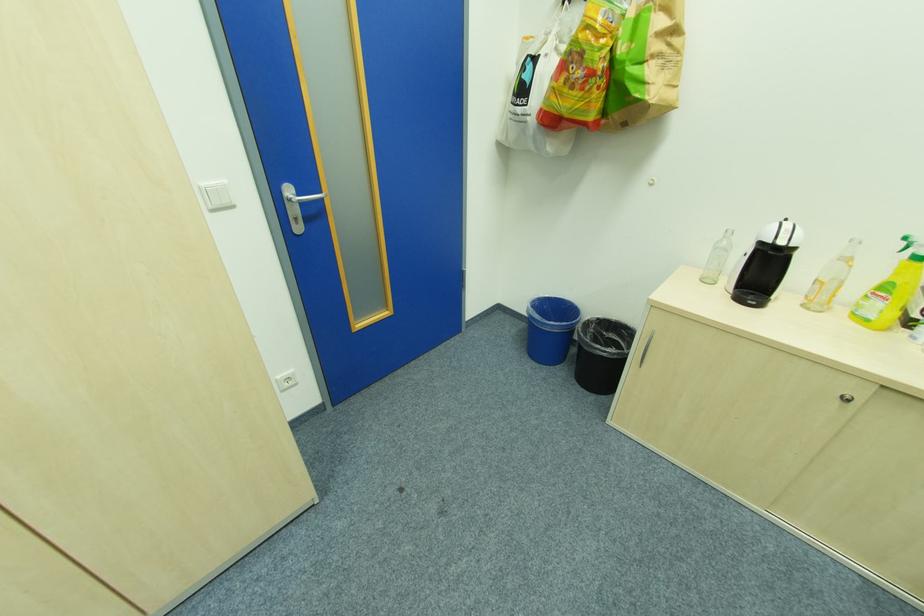
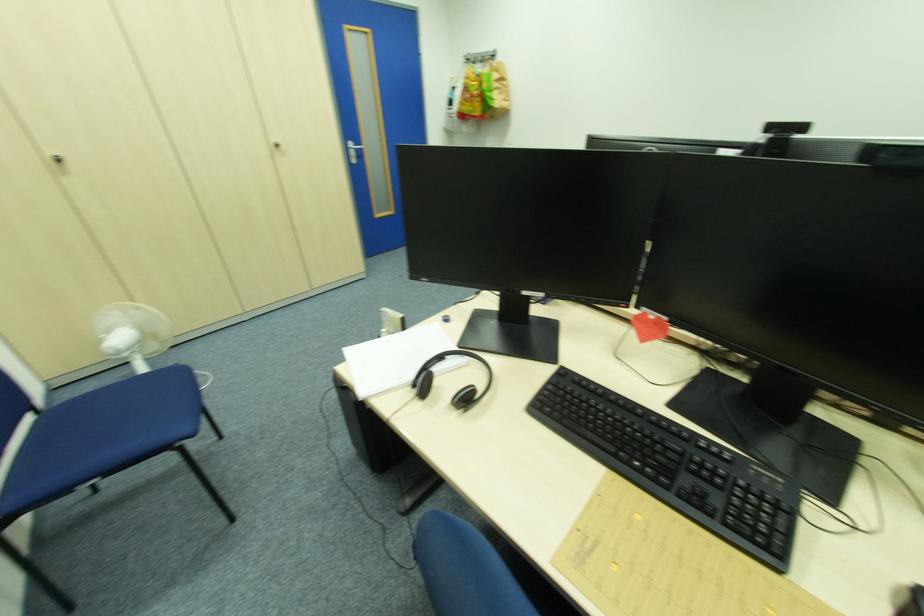
Question: The images are taken continuously from a first-person perspective. In which direction are you moving?

Choices:
 (A) Left
 (B) Right
 (C) Forward
 (D) Backward

Answer: (D)